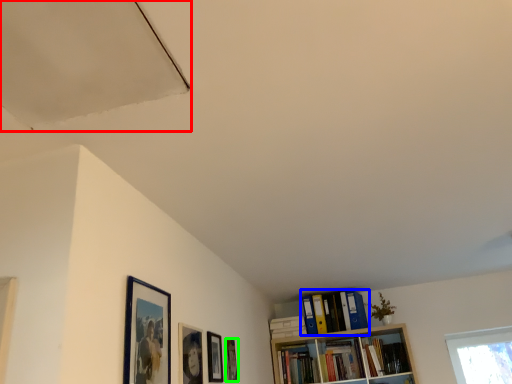
Question: Which object is the farthest from exhaust hood (highlighted by a red box)? Choose among these: book (highlighted by a blue box) or picture frame (highlighted by a green box).

Choices:
 (A) book
 (B) picture frame

Answer: (A)